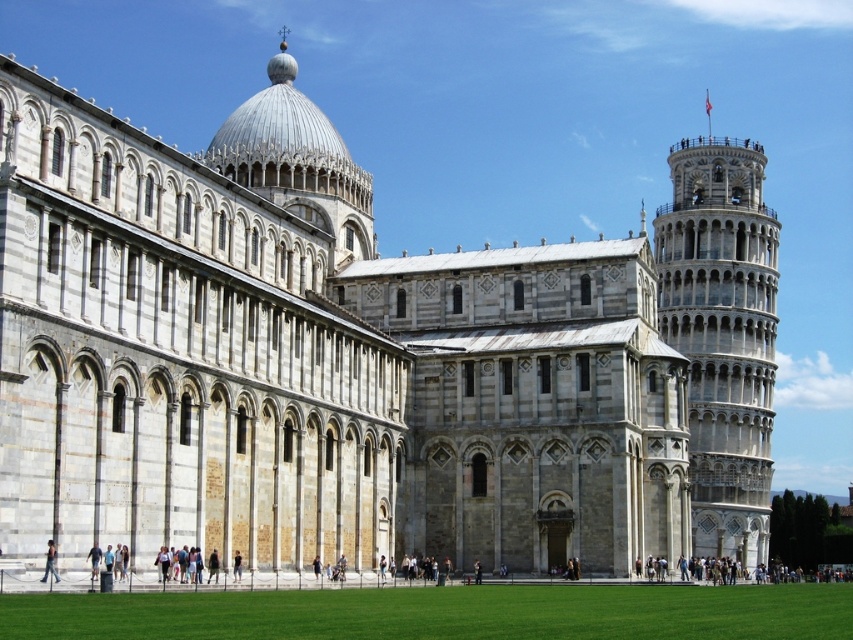
Does light gray stone tower at right have a smaller size compared to light brown leather jacket at lower left?

No, light gray stone tower at right is not smaller than light brown leather jacket at lower left.

What do you see at coordinates (722, 333) in the screenshot?
I see `light gray stone tower at right` at bounding box center [722, 333].

You are a GUI agent. You are given a task and a screenshot of the screen. Output one action in this format:
    pyautogui.click(x=<x>, y=<y>)
    Task: Click on the light gray stone tower at right
    
    Given the screenshot: What is the action you would take?
    pyautogui.click(x=722, y=333)